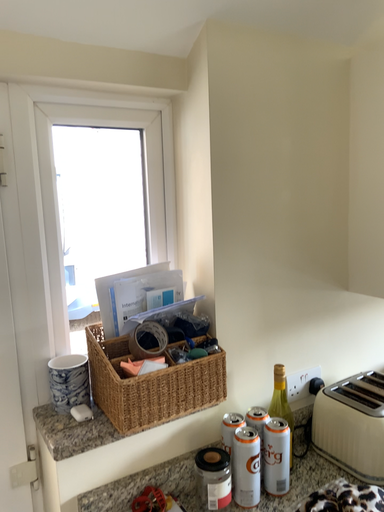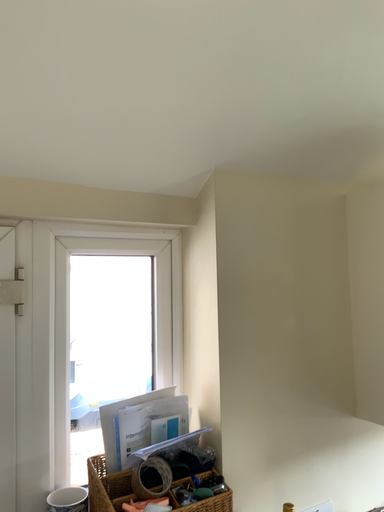
Question: How did the camera likely rotate when shooting the video?

Choices:
 (A) rotated downward
 (B) rotated upward

Answer: (B)